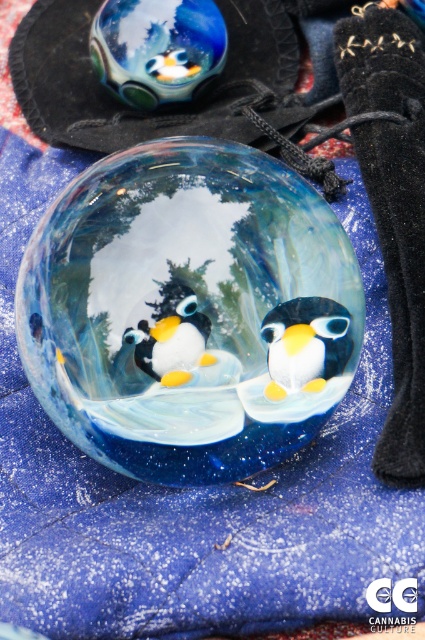
Question: Based on their relative distances, which object is nearer to the matte glass penguin at center?

Choices:
 (A) shiny glass penguin at center
 (B) transparent glass bowl at center

Answer: (A)

Question: Is transparent glass bowl at center positioned before matte glass penguin at center?

Choices:
 (A) no
 (B) yes

Answer: (B)

Question: Among these objects, which one is nearest to the camera?

Choices:
 (A) transparent glass bowl at center
 (B) matte glass penguin at center

Answer: (A)

Question: In this image, where is transparent glass bowl at center located relative to shiny glass penguin at center?

Choices:
 (A) above
 (B) below

Answer: (A)

Question: Does transparent glass bowl at center have a larger size compared to matte glass penguin at center?

Choices:
 (A) yes
 (B) no

Answer: (A)

Question: Among these points, which one is nearest to the camera?

Choices:
 (A) (169, 326)
 (B) (269, 355)
 (C) (127, 417)

Answer: (A)